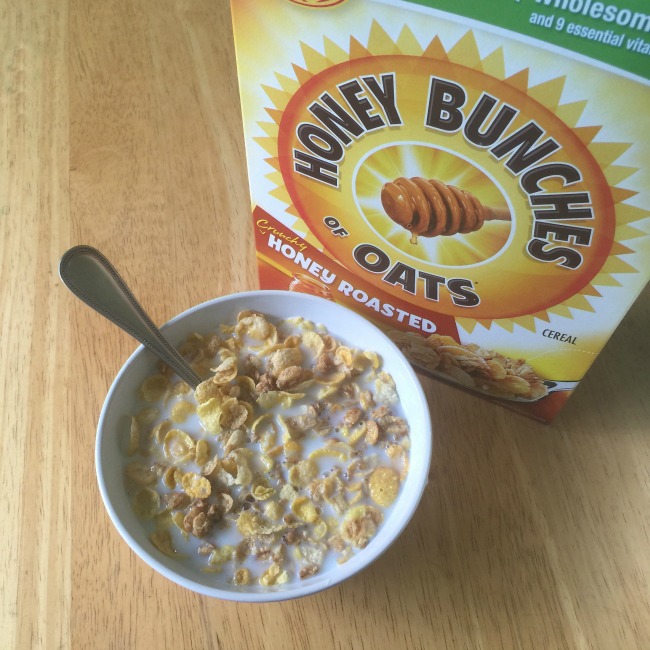
This screenshot has width=650, height=650. What are the coordinates of `bowl` in the screenshot? It's located at pyautogui.click(x=125, y=489).